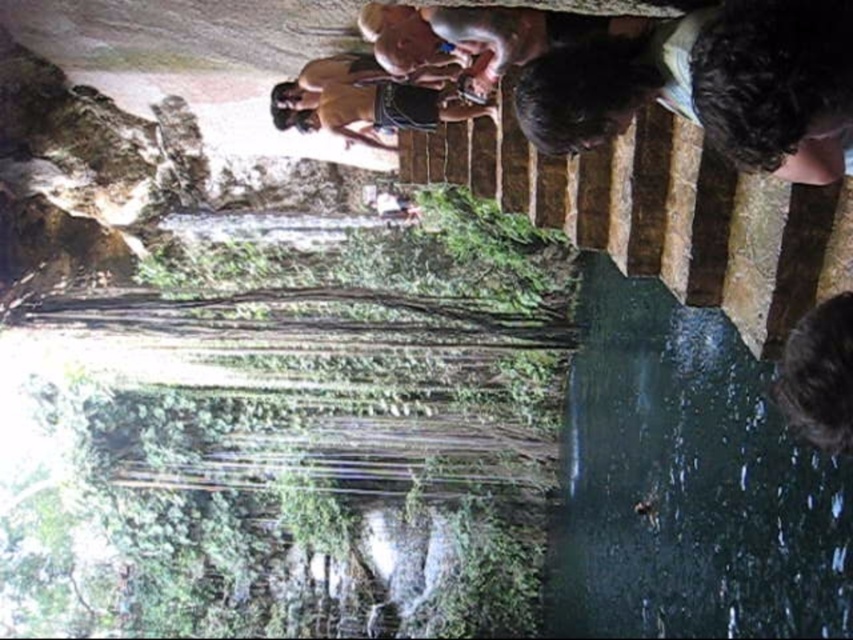
Which is more to the left, dark brown hair at lower right or brown skin person at upper center?

Positioned to the left is brown skin person at upper center.

Based on the photo, is dark brown hair at lower right bigger than brown skin person at upper center?

Incorrect, dark brown hair at lower right is not larger than brown skin person at upper center.

Is point (810, 412) closer to camera compared to point (360, 115)?

Yes, it is.

Identify the location of dark brown hair at lower right. (819, 374).

Which is behind, point (659, 522) or point (535, 97)?

The point (659, 522) is more distant.

What do you see at coordinates (688, 483) in the screenshot? This screenshot has height=640, width=853. I see `clear water at bottom right` at bounding box center [688, 483].

Who is more forward, (595, 433) or (709, 90)?

Point (709, 90) is in front.

Identify the location of clear water at bottom right. (688, 483).

Between point (715, 141) and point (308, 99), which one is positioned behind?

The point (308, 99) is more distant.

Between dark curly hair at upper center and brown skin person at upper center, which one appears on the left side from the viewer's perspective?

Positioned to the left is brown skin person at upper center.

Identify the location of dark curly hair at upper center. This screenshot has width=853, height=640. (712, 84).